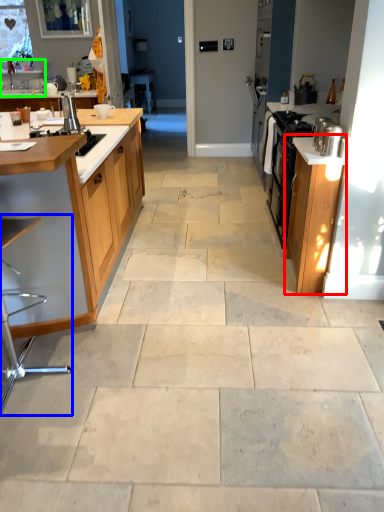
Question: Estimate the real-world distances between objects in this image. Which object is farther from cabinetry (highlighted by a red box), bar stool (highlighted by a blue box) or sink (highlighted by a green box)?

Choices:
 (A) bar stool
 (B) sink

Answer: (B)